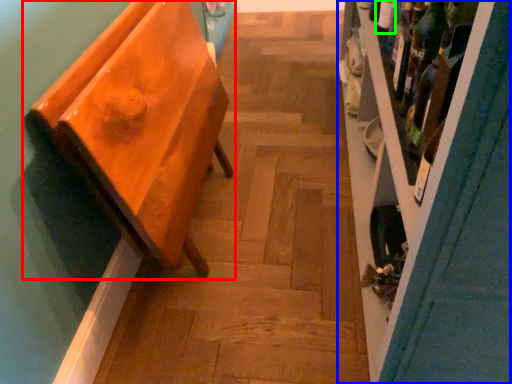
Question: Which is farther away from furniture (highlighted by a red box)? shelf (highlighted by a blue box) or bottle (highlighted by a green box)?

Choices:
 (A) shelf
 (B) bottle

Answer: (B)